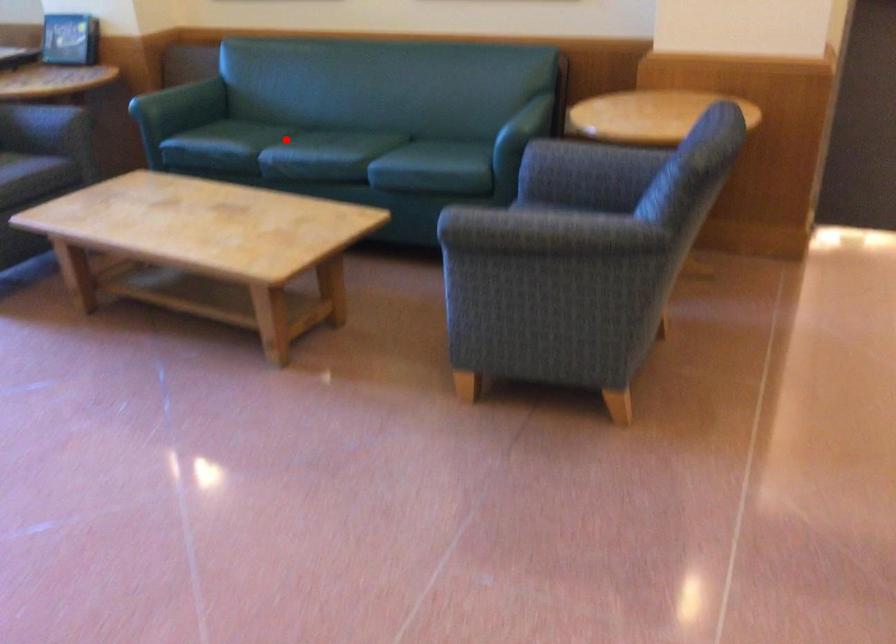
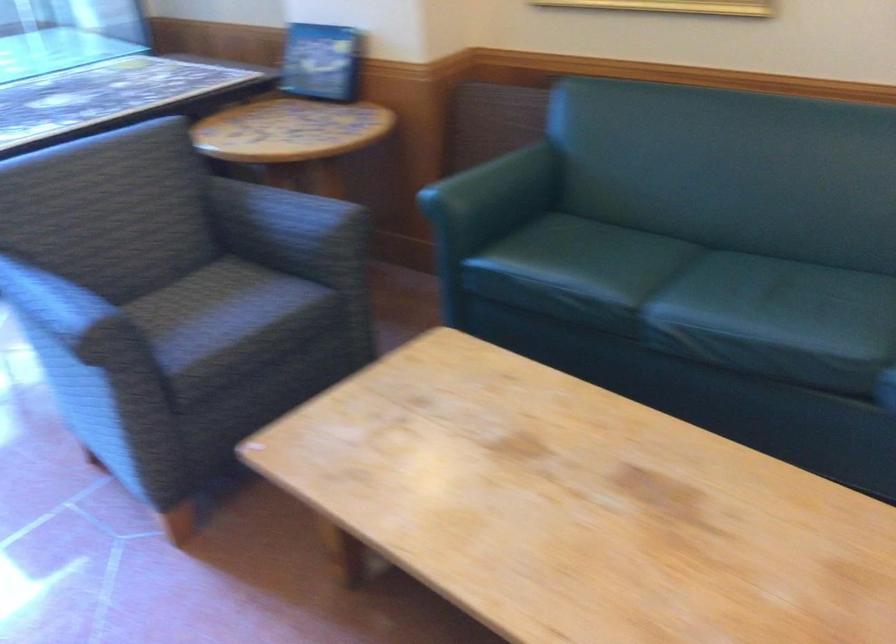
Where in the second image is the point corresponding to the highlighted location from the first image?

(679, 283)